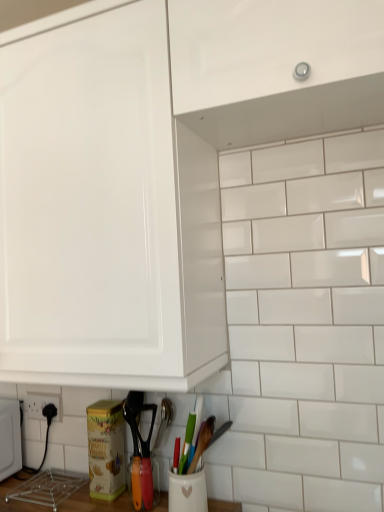
Question: From the image's perspective, is glossy white cabinet at upper center above or below wooden spatula at lower center?

Choices:
 (A) below
 (B) above

Answer: (B)

Question: In the image, is glossy white cabinet at upper center on the left side or the right side of wooden spatula at lower center?

Choices:
 (A) right
 (B) left

Answer: (A)

Question: Which object is positioned farthest from the black plastic electric outlet at lower left?

Choices:
 (A) wooden spatula at lower center
 (B) glossy white cabinet at upper center

Answer: (B)

Question: Which of these objects is positioned closest to the wooden spatula at lower center?

Choices:
 (A) glossy white cabinet at upper center
 (B) black plastic electric outlet at lower left

Answer: (B)